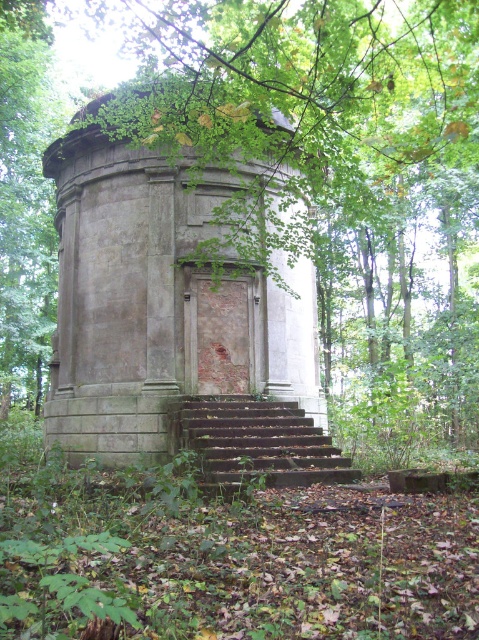
Based on the photo, who is positioned more to the right, gray stone monument at center or rusty metal stairs at center?

Positioned to the right is rusty metal stairs at center.

Who is positioned more to the left, gray stone monument at center or rusty metal stairs at center?

gray stone monument at center

Which is in front, point (61, 410) or point (286, 426)?

Point (286, 426)

Identify the location of gray stone monument at center. The image size is (479, 640). (174, 324).